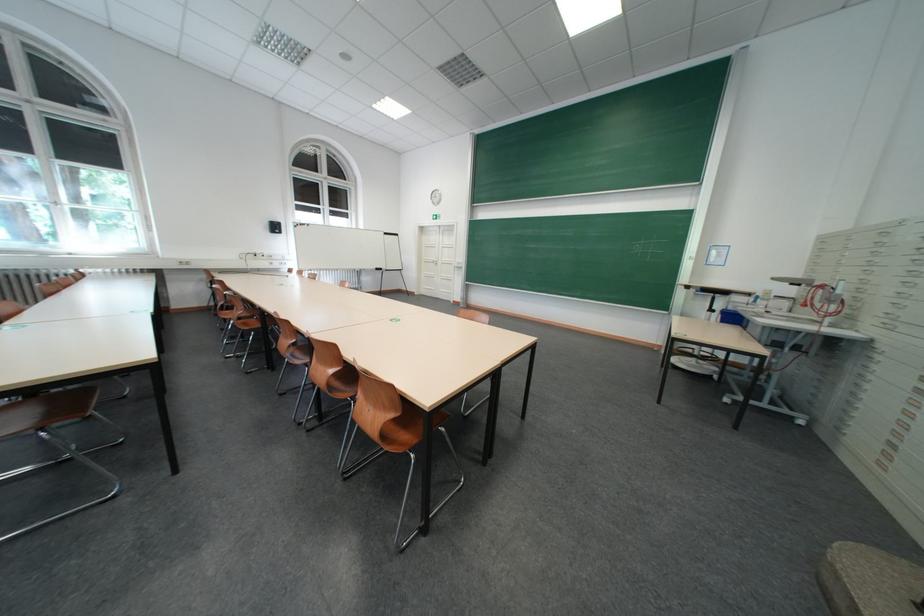
Describe the element at coordinates (400, 431) in the screenshot. I see `the brown chair sitting surface` at that location.